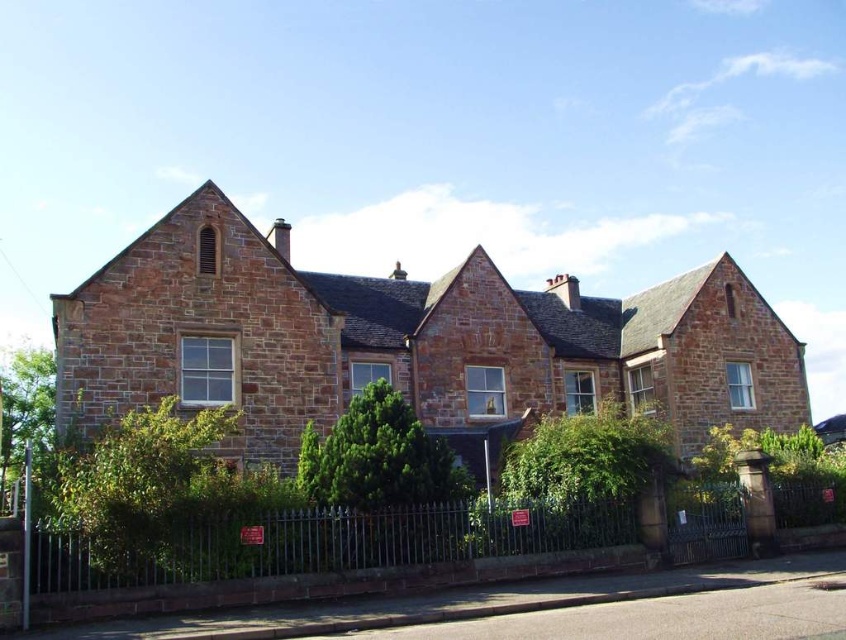
You are standing in front of the building and want to walk to the green leafy hedge at center. Which direction should you go to avoid the green leafy hedge at lower left?

The green leafy hedge at lower left is in front of green leafy hedge at center, so to reach the green leafy hedge at center without going through the hedge at lower left, you should move to the right or left side around it.

Looking at this image, you are a gardener standing at the entrance of the building and need to water both the green wrought iron fence at lower center and the green leafy hedge at lower right. The water hose you have can reach up to 4 meters. Can you water both objects without moving the hose? Please explain your reasoning based on their distance.

The green wrought iron fence at lower center is 4.35 meters away from the green leafy hedge at lower right. Since the hose can only reach up to 4 meters, the distance between them is greater than the hose length. Therefore, you cannot water both objects without moving the hose.